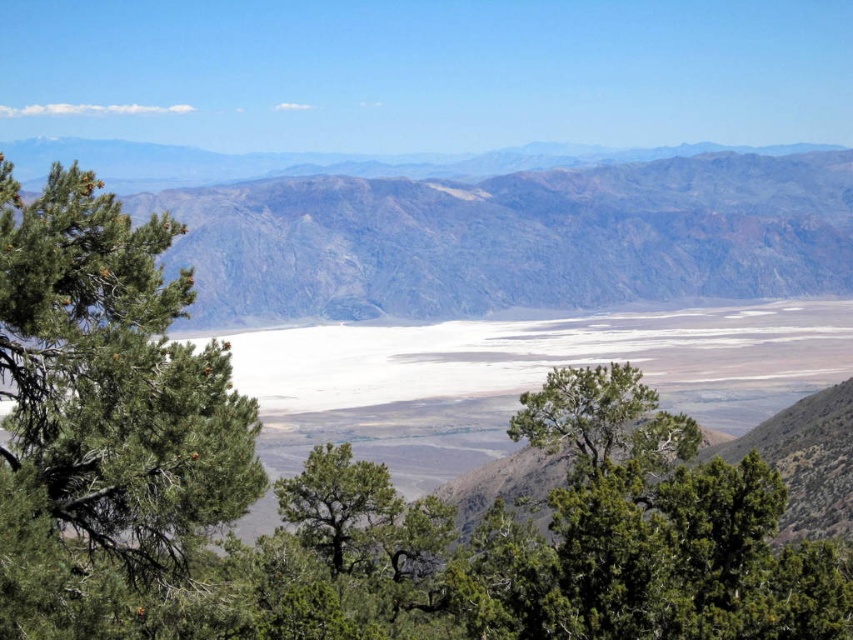
Question: Is brown rocky mountain range at center in front of green leafy tree at center?

Choices:
 (A) yes
 (B) no

Answer: (B)

Question: Can you confirm if green needle-like tree at center is smaller than green leafy tree at center?

Choices:
 (A) no
 (B) yes

Answer: (B)

Question: Can you confirm if green needle-like leaves at left is bigger than green leafy tree at center?

Choices:
 (A) no
 (B) yes

Answer: (A)

Question: Which is farther from the green needle-like tree at center?

Choices:
 (A) brown rocky mountain range at center
 (B) green leafy tree at center
 (C) green needle-like leaves at left

Answer: (A)

Question: Which is nearer to the green leafy tree at center?

Choices:
 (A) brown rocky mountain range at center
 (B) green needle-like leaves at left
 (C) green needle-like tree at center

Answer: (C)

Question: Which point is farther from the camera taking this photo?

Choices:
 (A) (288, 524)
 (B) (196, 468)

Answer: (A)